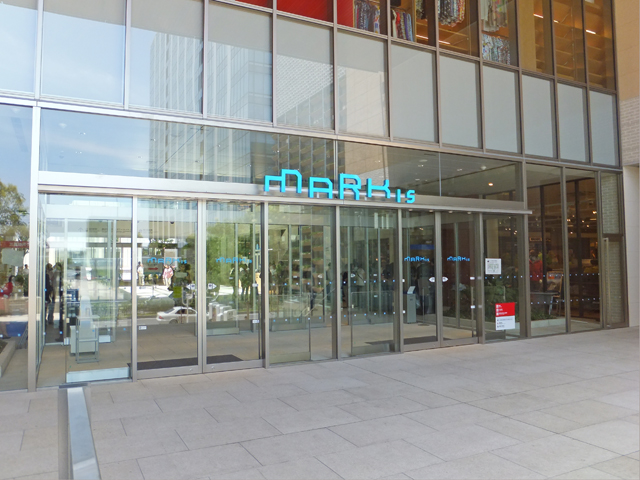
Where is `large frosted windows`? large frosted windows is located at coordinates (319, 94).